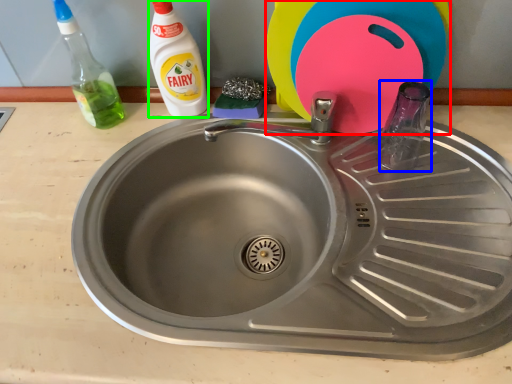
Question: Considering the real-world distances, which object is closest to toy (highlighted by a red box)? bottle (highlighted by a blue box) or cleaning product (highlighted by a green box).

Choices:
 (A) bottle
 (B) cleaning product

Answer: (A)